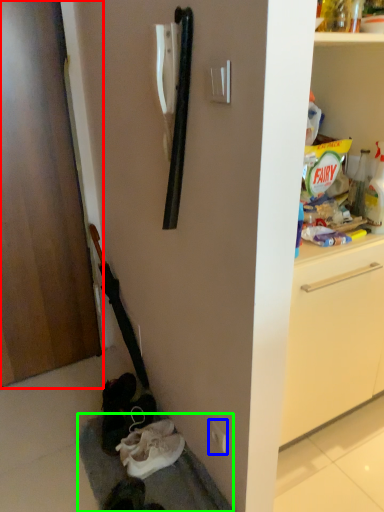
Question: Which object is positioned closest to door (highlighted by a red box)? Select from electric outlet (highlighted by a blue box) and gray (highlighted by a green box).

Choices:
 (A) electric outlet
 (B) gray

Answer: (B)